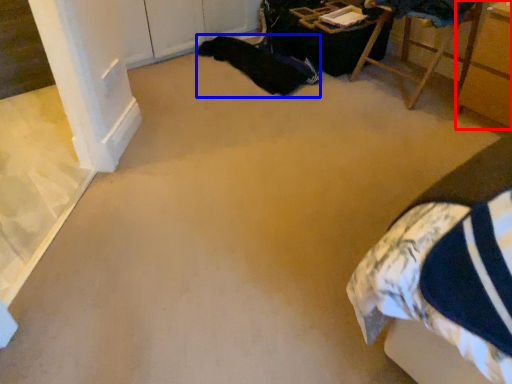
Question: Which of the following is the farthest to the observer, furniture (highlighted by a red box) or blanket (highlighted by a blue box)?

Choices:
 (A) furniture
 (B) blanket

Answer: (B)